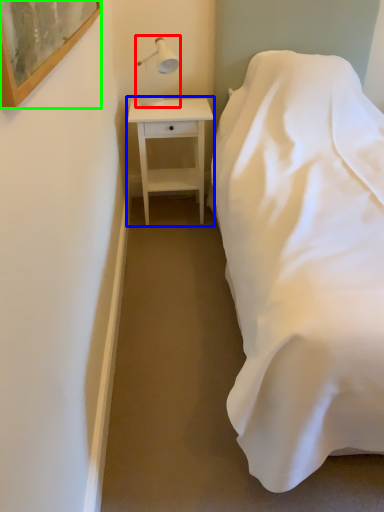
Question: Which object is positioned closest to table lamp (highlighted by a red box)? Select from nightstand (highlighted by a blue box) and picture frame (highlighted by a green box).

Choices:
 (A) nightstand
 (B) picture frame

Answer: (A)